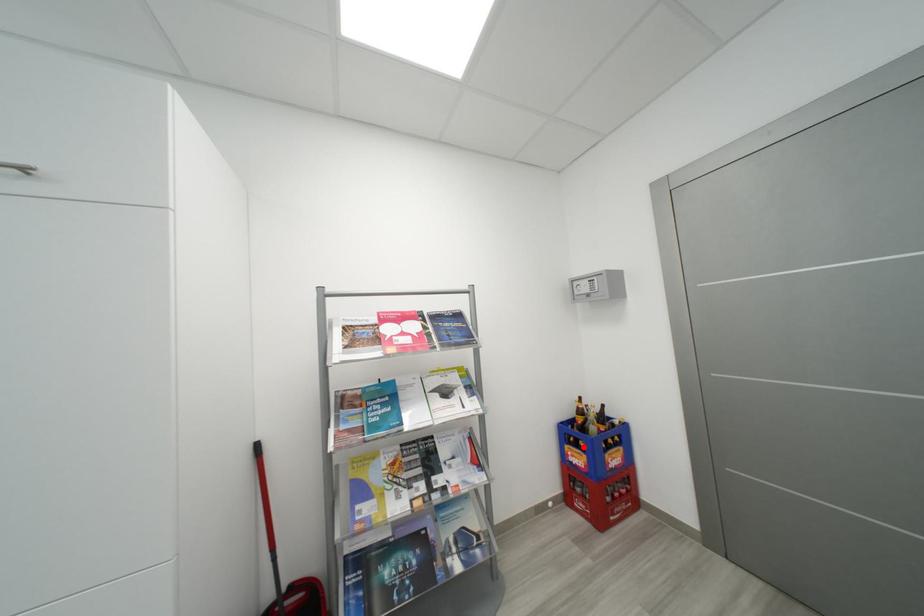
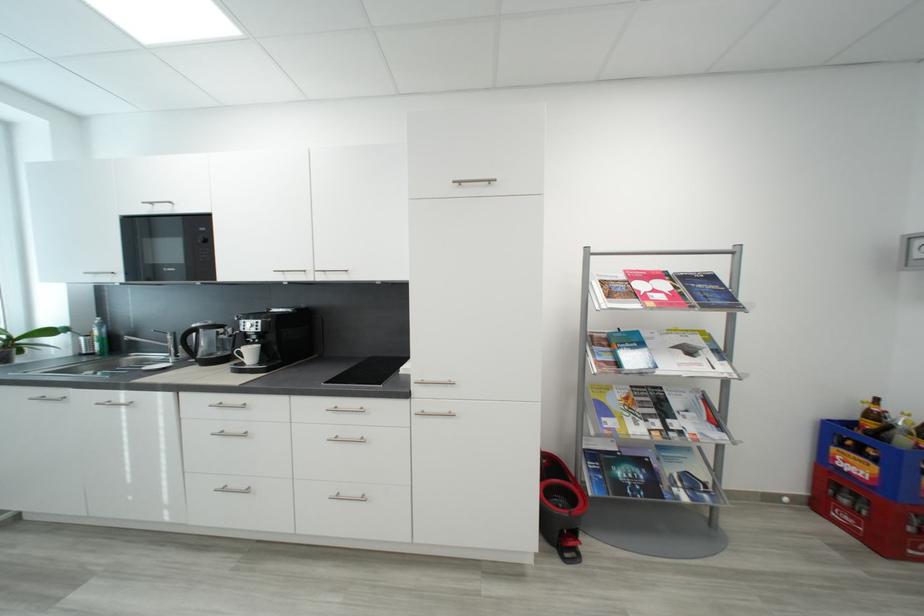
Question: I am providing you with two images of the same scene from different viewpoints. Given a red point in image1, look at the same physical point in image2. Is it:

Choices:
 (A) Closer to the viewpoint
 (B) Farther from the viewpoint

Answer: (A)